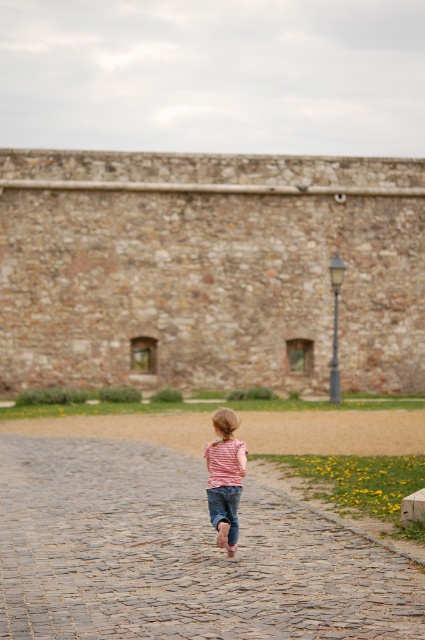
Question: Which object is closer to the camera taking this photo?

Choices:
 (A) jeans at center
 (B) striped fabric shirt at center
 (C) cobblestone path at center
 (D) stone wall at upper center

Answer: (C)

Question: Which point is closer to the camera?

Choices:
 (A) striped fabric shirt at center
 (B) stone wall at upper center
 (C) cobblestone path at center
 (D) jeans at center

Answer: (C)

Question: Which is farther from the stone wall at upper center?

Choices:
 (A) jeans at center
 (B) striped fabric shirt at center
 (C) cobblestone path at center

Answer: (A)

Question: Can you confirm if cobblestone path at center is positioned to the left of striped fabric shirt at center?

Choices:
 (A) no
 (B) yes

Answer: (B)

Question: Is stone wall at upper center bigger than jeans at center?

Choices:
 (A) yes
 (B) no

Answer: (A)

Question: Can you confirm if stone wall at upper center is thinner than striped fabric shirt at center?

Choices:
 (A) no
 (B) yes

Answer: (A)